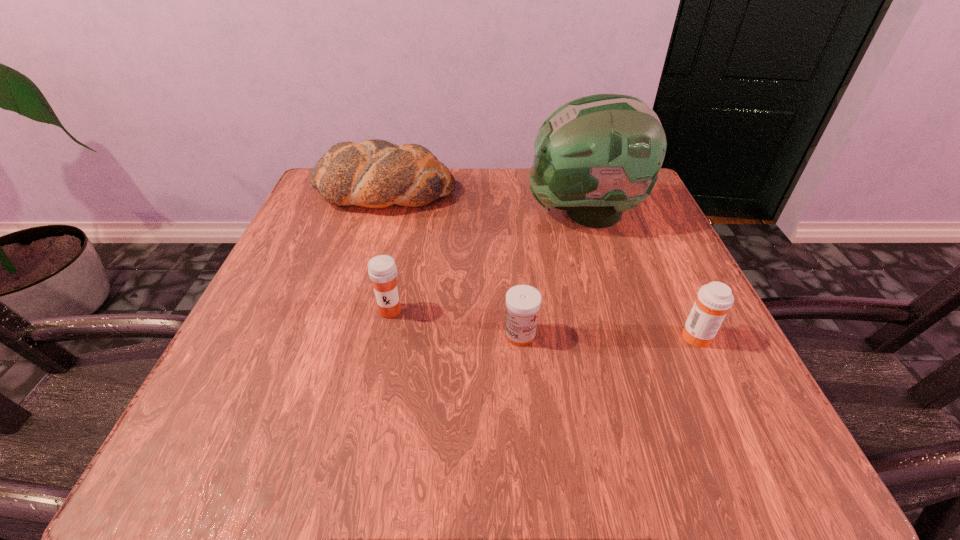
Identify the location of football helmet. This screenshot has width=960, height=540. (596, 156).

Locate an element on the screen. The height and width of the screenshot is (540, 960). bread is located at coordinates (375, 173).

The width and height of the screenshot is (960, 540). Identify the location of the leftmost medicine. (382, 270).

The image size is (960, 540). Identify the location of the farthest medicine. [x=382, y=270].

Locate an element on the screen. the rightmost medicine is located at coordinates click(x=713, y=301).

Find the location of a particular element. the second medicine from right to left is located at coordinates (523, 302).

The image size is (960, 540). I want to click on the shortest object, so click(x=523, y=302).

Image resolution: width=960 pixels, height=540 pixels. Identify the location of vacant area situated on the visor of the tallest object. (457, 213).

You are a GUI agent. You are given a task and a screenshot of the screen. Output one action in this format:
    pyautogui.click(x=<x>, y=<y>)
    Task: Click on the vacant space located on the visor of the tallest object
    Image resolution: width=960 pixels, height=540 pixels.
    Given the screenshot: What is the action you would take?
    pyautogui.click(x=493, y=213)

Locate an element on the screen. The height and width of the screenshot is (540, 960). vacant space positioned on the visor of the tallest object is located at coordinates (396, 213).